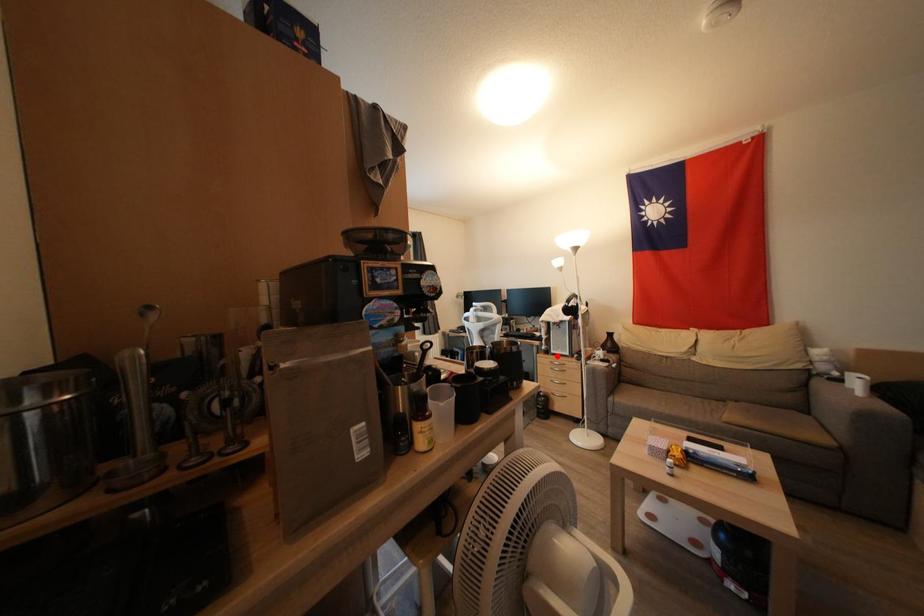
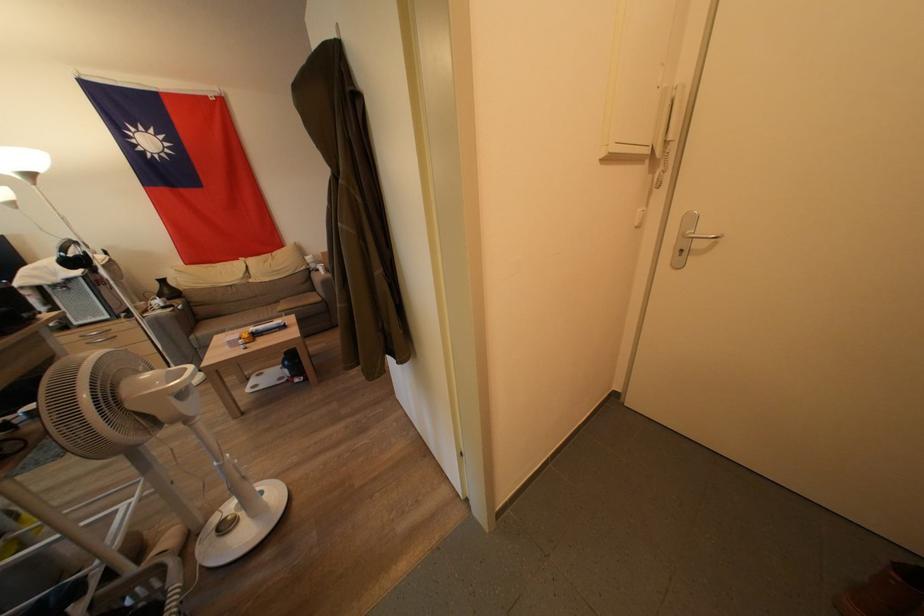
The point at the highlighted location is marked in the first image. Where is the corresponding point in the second image?

(81, 328)